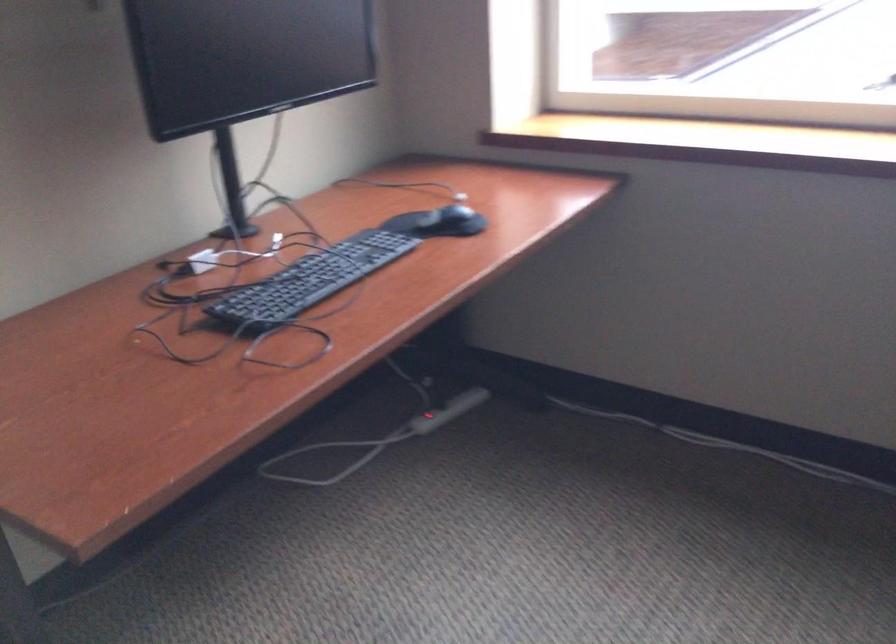
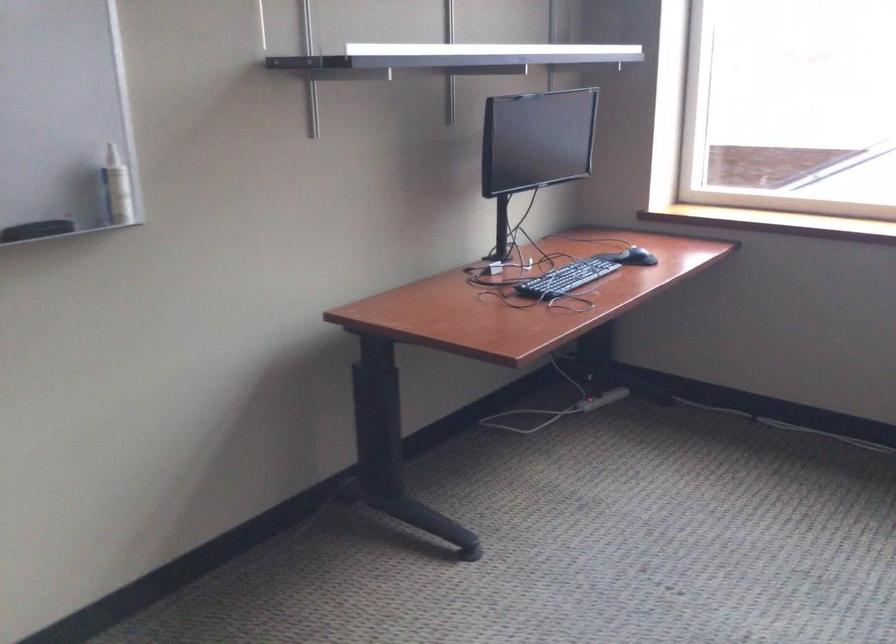
In the second image, find the point that corresponds to (459,223) in the first image.

(636, 257)